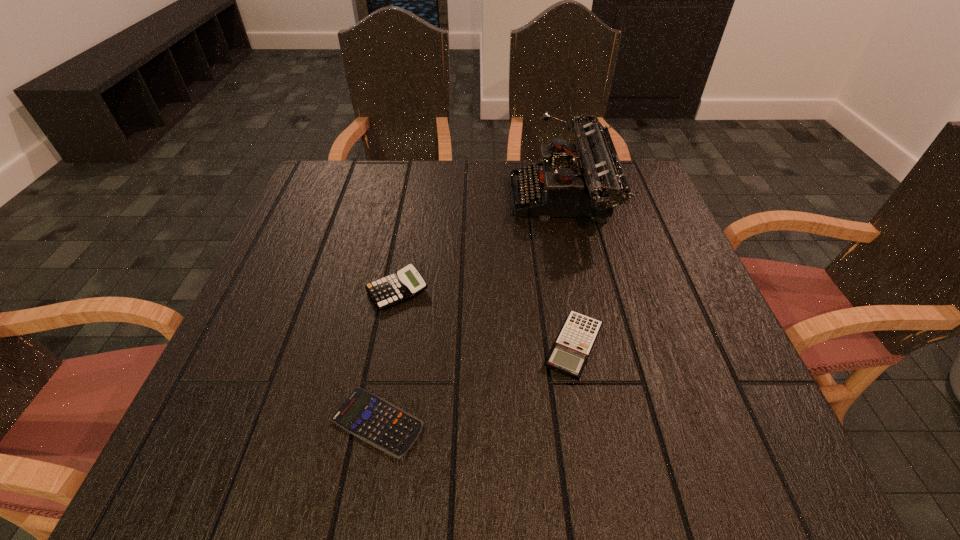
The image size is (960, 540). Find the location of `vacant space located 0.300m on the keyboard of the typewriter`. vacant space located 0.300m on the keyboard of the typewriter is located at coordinates (395, 200).

The width and height of the screenshot is (960, 540). Find the location of `vacant space positioned 0.160m on the right of the farthest calculator`. vacant space positioned 0.160m on the right of the farthest calculator is located at coordinates (505, 291).

Where is `vacant space located on the left of the second farthest calculator`? vacant space located on the left of the second farthest calculator is located at coordinates (444, 346).

Locate an element on the screen. vacant space situated 0.310m on the back of the shortest object is located at coordinates (405, 265).

Where is `object situated at the far edge`? The height and width of the screenshot is (540, 960). object situated at the far edge is located at coordinates (590, 182).

What are the coordinates of `object at the near edge` in the screenshot? It's located at [374, 420].

This screenshot has height=540, width=960. In order to click on object present at the right edge in this screenshot , I will do `click(590, 182)`.

Where is `object that is at the far right corner`? object that is at the far right corner is located at coordinates click(x=590, y=182).

What are the coordinates of `free space at the far edge` in the screenshot? It's located at (508, 181).

This screenshot has height=540, width=960. Identify the location of vacant space at the near edge of the desktop. pos(509,465).